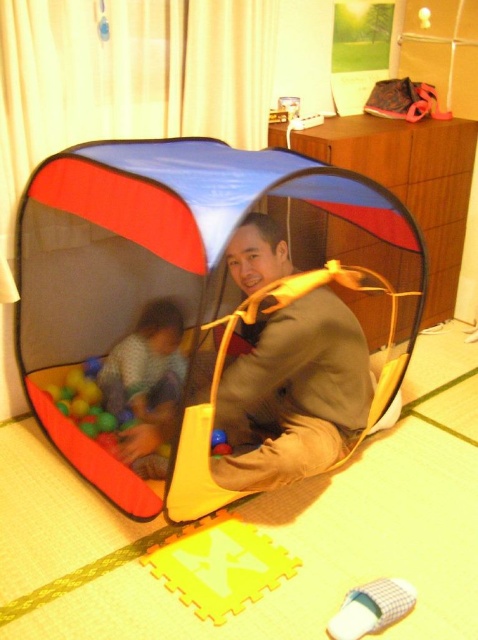
Question: Is brown suede jacket at center to the left of patterned fabric child at center from the viewer's perspective?

Choices:
 (A) no
 (B) yes

Answer: (A)

Question: Among these objects, which one is nearest to the camera?

Choices:
 (A) brown suede jacket at center
 (B) patterned fabric child at center

Answer: (A)

Question: Which of the following is the closest to the observer?

Choices:
 (A) (304, 369)
 (B) (131, 458)

Answer: (A)

Question: Is brown suede jacket at center below patterned fabric child at center?

Choices:
 (A) yes
 (B) no

Answer: (B)

Question: Does brown suede jacket at center have a greater width compared to patterned fabric child at center?

Choices:
 (A) no
 (B) yes

Answer: (B)

Question: Which of the following is the closest to the observer?

Choices:
 (A) brown suede jacket at center
 (B) patterned fabric child at center

Answer: (A)